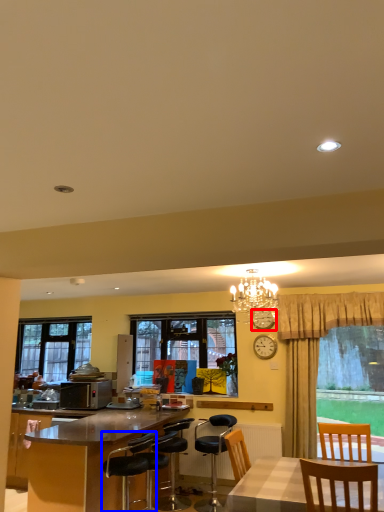
Question: Among these objects, which one is nearest to the camera, clock (highlighted by a red box) or chair (highlighted by a blue box)?

Choices:
 (A) clock
 (B) chair

Answer: (B)